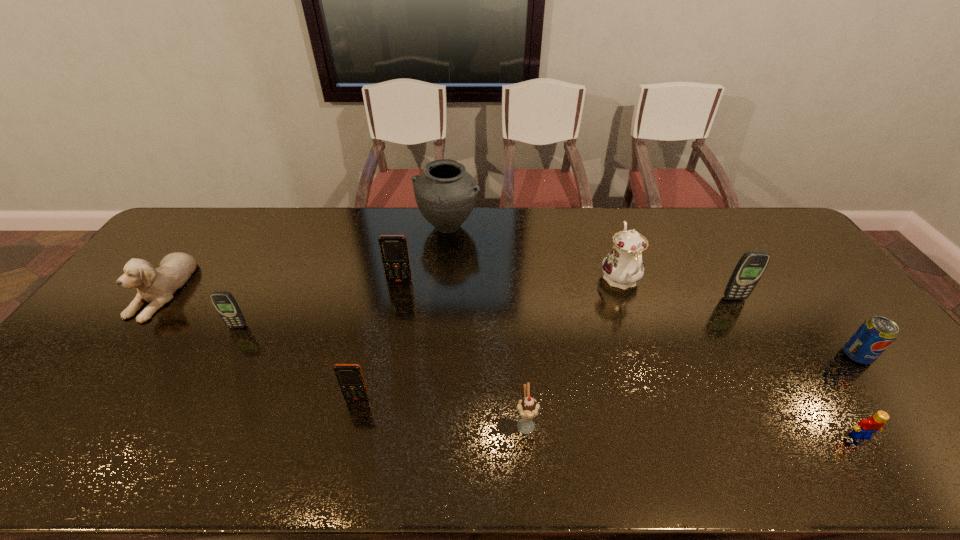
Locate which cellular telephone ranks fourth in proximity to the urn. Please provide its 2D coordinates. Your answer should be formatted as a tuple, i.e. [(x, y)], where the tuple contains the x and y coordinates of a point satisfying the conditions above.

[(751, 266)]

Identify which cellular telephone is the closest to the icecream. Please provide its 2D coordinates. Your answer should be formatted as a tuple, i.e. [(x, y)], where the tuple contains the x and y coordinates of a point satisfying the conditions above.

[(350, 378)]

This screenshot has height=540, width=960. Identify the location of free spot that satisfies the following two spatial constraints: 1. on the screen of the eighth farthest object; 2. on the right side of the icecream. (351, 423).